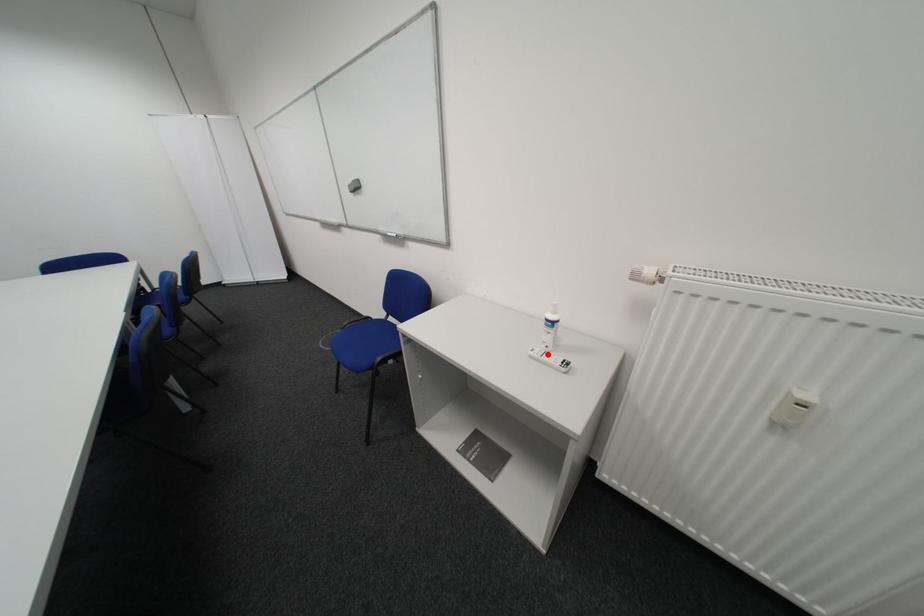
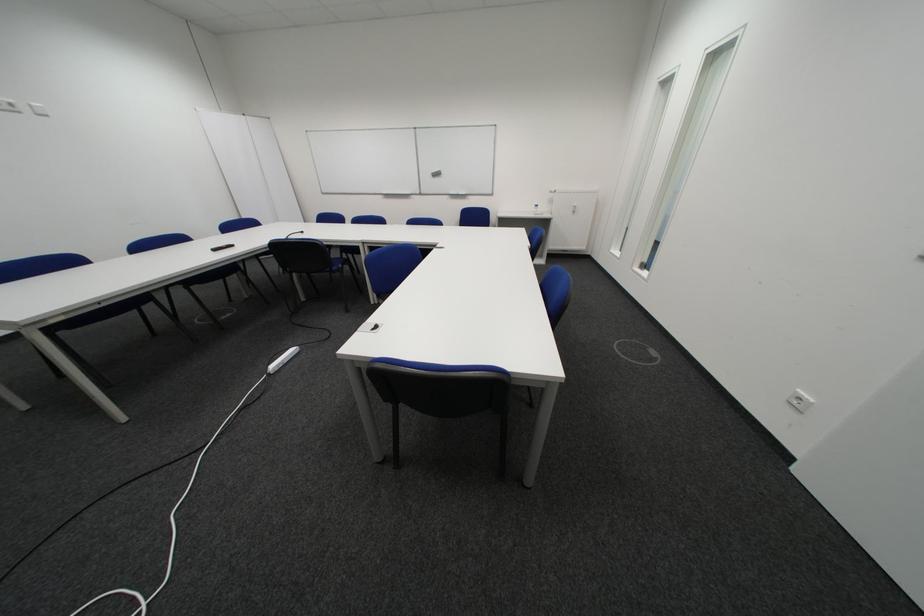
The point at the highlighted location is marked in the first image. Where is the corresponding point in the second image?

(548, 215)